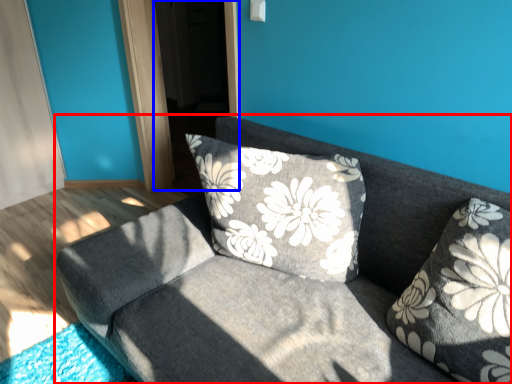
Question: Which object appears closest to the camera in this image, studio couch (highlighted by a red box) or screen door (highlighted by a blue box)?

Choices:
 (A) studio couch
 (B) screen door

Answer: (A)